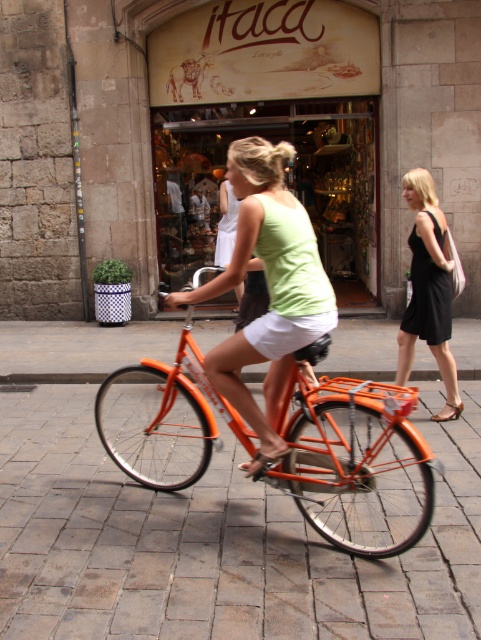
Question: Can you confirm if orange metallic bicycle at center is positioned to the left of matte glass storefront at center?

Choices:
 (A) no
 (B) yes

Answer: (B)

Question: Which of the following is the closest to the observer?

Choices:
 (A) (218, 282)
 (B) (293, 529)
 (C) (291, 168)
 (D) (417, 532)

Answer: (D)

Question: Can you confirm if brick pavement at center is wider than matte glass storefront at center?

Choices:
 (A) no
 (B) yes

Answer: (B)

Question: Among these objects, which one is nearest to the camera?

Choices:
 (A) matte green tank top at center
 (B) matte glass storefront at center

Answer: (A)

Question: Can you confirm if brick pavement at center is smaller than matte glass storefront at center?

Choices:
 (A) no
 (B) yes

Answer: (A)

Question: Which point is farther from the camera taking this photo?

Choices:
 (A) (463, 637)
 (B) (203, 291)

Answer: (B)